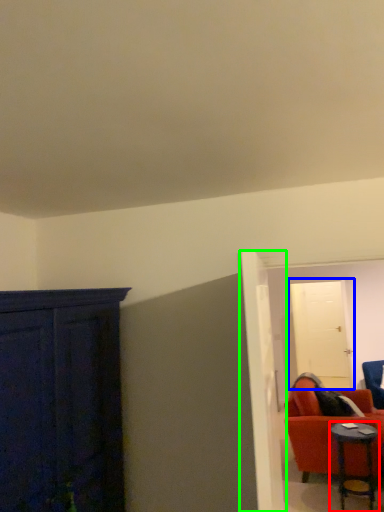
Question: Considering the real-world distances, which object is closest to table (highlighted by a red box)? door (highlighted by a blue box) or door (highlighted by a green box).

Choices:
 (A) door
 (B) door

Answer: (A)